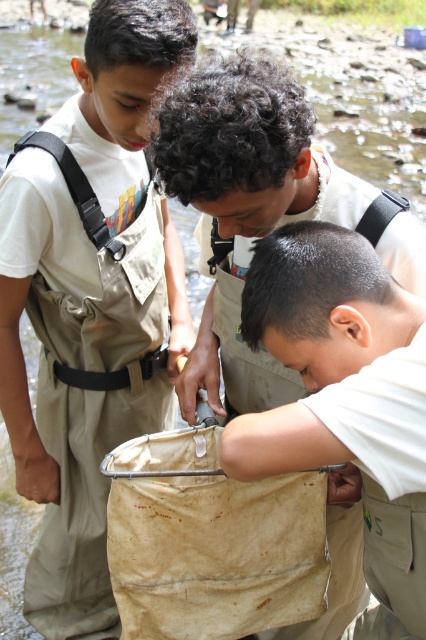
Question: Can you confirm if white matte cloth at lower center is thinner than tan fabric bag at center?

Choices:
 (A) yes
 (B) no

Answer: (A)

Question: Is the position of matte khaki waders at left less distant than that of white matte cloth at lower center?

Choices:
 (A) no
 (B) yes

Answer: (A)

Question: Which object is farther from the camera taking this photo?

Choices:
 (A) white matte cloth at lower center
 (B) matte khaki waders at left
 (C) tan fabric bag at center

Answer: (B)

Question: Considering the relative positions of matte khaki waders at left and tan fabric bag at center in the image provided, where is matte khaki waders at left located with respect to tan fabric bag at center?

Choices:
 (A) left
 (B) right

Answer: (A)

Question: Among these points, which one is farthest from the camera?

Choices:
 (A) (14, 384)
 (B) (405, 435)
 (C) (261, 209)

Answer: (A)

Question: Which point appears farthest from the camera in this image?

Choices:
 (A) (279, 232)
 (B) (138, 388)

Answer: (B)